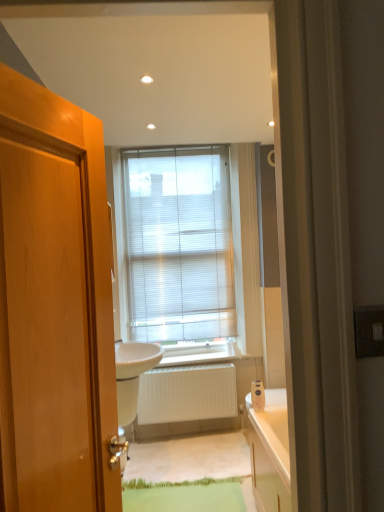
Question: Should I look upward or downward to see white glossy sink at center?

Choices:
 (A) up
 (B) down

Answer: (B)

Question: Is white matte radiator at center at the left side of silver metallic door handle at lower left?

Choices:
 (A) no
 (B) yes

Answer: (A)

Question: Is white matte radiator at center facing towards silver metallic door handle at lower left?

Choices:
 (A) yes
 (B) no

Answer: (A)

Question: Is white matte radiator at center outside of silver metallic door handle at lower left?

Choices:
 (A) no
 (B) yes

Answer: (B)

Question: Is white matte radiator at center facing away from silver metallic door handle at lower left?

Choices:
 (A) no
 (B) yes

Answer: (A)

Question: Can you confirm if white matte radiator at center is shorter than silver metallic door handle at lower left?

Choices:
 (A) no
 (B) yes

Answer: (A)

Question: Is white matte radiator at center bigger than silver metallic door handle at lower left?

Choices:
 (A) yes
 (B) no

Answer: (A)

Question: From the image's perspective, does white glossy sink at center appear higher than silver metallic door handle at lower left?

Choices:
 (A) yes
 (B) no

Answer: (A)

Question: Does white glossy sink at center have a greater height compared to silver metallic door handle at lower left?

Choices:
 (A) yes
 (B) no

Answer: (A)

Question: Could you tell me if white glossy sink at center is facing silver metallic door handle at lower left?

Choices:
 (A) no
 (B) yes

Answer: (A)

Question: Does white glossy sink at center have a lesser width compared to silver metallic door handle at lower left?

Choices:
 (A) no
 (B) yes

Answer: (A)

Question: Can you confirm if white glossy sink at center is shorter than silver metallic door handle at lower left?

Choices:
 (A) yes
 (B) no

Answer: (B)

Question: Is white glossy sink at center wider than silver metallic door handle at lower left?

Choices:
 (A) no
 (B) yes

Answer: (B)

Question: From a real-world perspective, is white/translucent blinds at center located higher than white glossy sink at center?

Choices:
 (A) yes
 (B) no

Answer: (A)